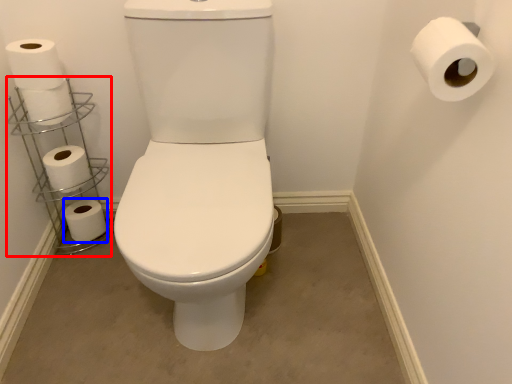
Question: Among these objects, which one is farthest to the camera, shelf (highlighted by a red box) or toilet paper (highlighted by a blue box)?

Choices:
 (A) shelf
 (B) toilet paper

Answer: (B)